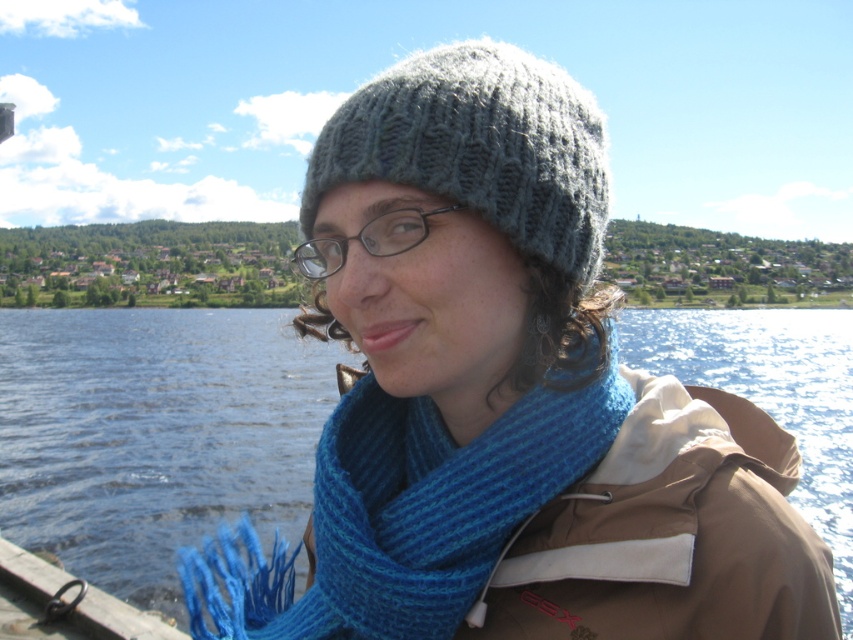
Question: Which object appears closest to the camera in this image?

Choices:
 (A) knitted gray hat at center
 (B) knitted woolen hat at center
 (C) blue knitted scarf at center

Answer: (B)

Question: Among these objects, which one is farthest from the camera?

Choices:
 (A) blue knitted scarf at center
 (B) knitted woolen hat at center
 (C) knitted gray hat at center

Answer: (C)

Question: Is blue knitted scarf at center positioned behind knitted gray hat at center?

Choices:
 (A) yes
 (B) no

Answer: (B)

Question: Is blue knitted scarf at center positioned at the back of knitted gray hat at center?

Choices:
 (A) yes
 (B) no

Answer: (B)

Question: Based on their relative distances, which object is farther from the knitted woolen hat at center?

Choices:
 (A) blue knitted scarf at center
 (B) knitted gray hat at center

Answer: (B)

Question: Is blue knitted scarf at center positioned in front of knitted gray hat at center?

Choices:
 (A) no
 (B) yes

Answer: (B)